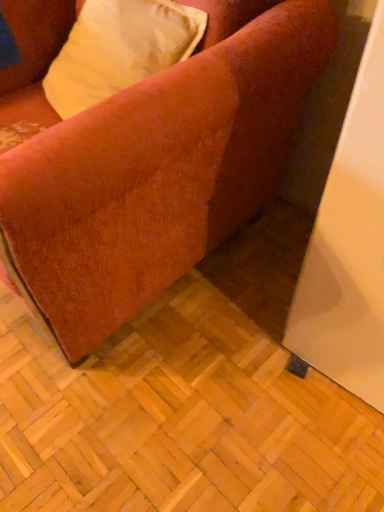
What do you see at coordinates (119, 49) in the screenshot? The image size is (384, 512). I see `velvet-like beige pillow at upper left` at bounding box center [119, 49].

Find the location of a particular element. velvet-like beige pillow at upper left is located at coordinates pos(119,49).

Measure the distance between velvet-like beige pillow at upper left and camera.

A distance of 36.26 inches exists between velvet-like beige pillow at upper left and camera.

Identify the location of velvet-like orange couch at lower left. This screenshot has height=512, width=384. (148, 159).

Measure the distance between point (85, 296) and camera.

The distance of point (85, 296) from camera is 34.49 inches.

This screenshot has width=384, height=512. What do you see at coordinates (148, 159) in the screenshot?
I see `velvet-like orange couch at lower left` at bounding box center [148, 159].

The height and width of the screenshot is (512, 384). In order to click on velvet-like beige pillow at upper left in this screenshot , I will do `click(119, 49)`.

Considering the relative positions of velvet-like orange couch at lower left and velvet-like beige pillow at upper left in the image provided, is velvet-like orange couch at lower left to the left or to the right of velvet-like beige pillow at upper left?

velvet-like orange couch at lower left is positioned on velvet-like beige pillow at upper left's left side.

Does velvet-like orange couch at lower left come in front of velvet-like beige pillow at upper left?

That is True.

Is point (112, 239) positioned before point (71, 113)?

That is True.

From the image's perspective, is velvet-like orange couch at lower left located above velvet-like beige pillow at upper left?

No.

From a real-world perspective, who is located lower, velvet-like orange couch at lower left or velvet-like beige pillow at upper left?

velvet-like orange couch at lower left.

Between velvet-like orange couch at lower left and velvet-like beige pillow at upper left, which one has larger width?

With larger width is velvet-like orange couch at lower left.

Which of these two, velvet-like orange couch at lower left or velvet-like beige pillow at upper left, stands taller?

With more height is velvet-like orange couch at lower left.

Who is bigger, velvet-like orange couch at lower left or velvet-like beige pillow at upper left?

velvet-like orange couch at lower left.

Does velvet-like orange couch at lower left contain velvet-like beige pillow at upper left?

Yes, velvet-like beige pillow at upper left is inside velvet-like orange couch at lower left.

Is velvet-like orange couch at lower left not near velvet-like beige pillow at upper left?

velvet-like orange couch at lower left is actually quite close to velvet-like beige pillow at upper left.

Does velvet-like orange couch at lower left turn towards velvet-like beige pillow at upper left?

Yes.

Can you tell me how much velvet-like orange couch at lower left and velvet-like beige pillow at upper left differ in facing direction?

The angular difference between velvet-like orange couch at lower left and velvet-like beige pillow at upper left is 9.75 degrees.

Image resolution: width=384 pixels, height=512 pixels. In order to click on studio couch below the velvet-like beige pillow at upper left (from a real-world perspective) in this screenshot , I will do `click(148, 159)`.

Is velvet-like beige pillow at upper left to the left or to the right of velvet-like orange couch at lower left in the image?

Clearly, velvet-like beige pillow at upper left is on the right of velvet-like orange couch at lower left in the image.

Considering the positions of objects velvet-like beige pillow at upper left and velvet-like orange couch at lower left in the image provided, who is in front, velvet-like beige pillow at upper left or velvet-like orange couch at lower left?

Positioned in front is velvet-like orange couch at lower left.

Which point is more distant from viewer, (158, 5) or (233, 162)?

The point (158, 5) is more distant.

From the image's perspective, is velvet-like beige pillow at upper left above velvet-like orange couch at lower left?

Yes, from the image's perspective, velvet-like beige pillow at upper left is above velvet-like orange couch at lower left.

From a real-world perspective, between velvet-like beige pillow at upper left and velvet-like orange couch at lower left, who is vertically lower?

velvet-like orange couch at lower left is physically lower.

Considering the sizes of velvet-like beige pillow at upper left and velvet-like orange couch at lower left in the image, is velvet-like beige pillow at upper left wider or thinner than velvet-like orange couch at lower left?

Clearly, velvet-like beige pillow at upper left has less width compared to velvet-like orange couch at lower left.

Which of these two, velvet-like beige pillow at upper left or velvet-like orange couch at lower left, stands taller?

Standing taller between the two is velvet-like orange couch at lower left.

Does velvet-like beige pillow at upper left have a larger size compared to velvet-like orange couch at lower left?

Incorrect, velvet-like beige pillow at upper left is not larger than velvet-like orange couch at lower left.

Would you say velvet-like beige pillow at upper left is inside or outside velvet-like orange couch at lower left?

velvet-like beige pillow at upper left can be found inside velvet-like orange couch at lower left.

Is velvet-like beige pillow at upper left positioned far away from velvet-like orange couch at lower left?

velvet-like beige pillow at upper left is near velvet-like orange couch at lower left, not far away.

Is velvet-like beige pillow at upper left facing towards velvet-like orange couch at lower left?

Yes, velvet-like beige pillow at upper left is aimed at velvet-like orange couch at lower left.

Can you tell me how much velvet-like beige pillow at upper left and velvet-like orange couch at lower left differ in facing direction?

The facing directions of velvet-like beige pillow at upper left and velvet-like orange couch at lower left are 9.75 degrees apart.

How distant is velvet-like beige pillow at upper left from velvet-like orange couch at lower left?

velvet-like beige pillow at upper left and velvet-like orange couch at lower left are 10.87 inches apart.

I want to click on pillow behind the velvet-like orange couch at lower left, so click(119, 49).

The width and height of the screenshot is (384, 512). Find the location of `studio couch in front of the velvet-like beige pillow at upper left`. studio couch in front of the velvet-like beige pillow at upper left is located at coordinates (148, 159).

Find the location of a particular element. The height and width of the screenshot is (512, 384). pillow above the velvet-like orange couch at lower left (from the image's perspective) is located at coordinates (119, 49).